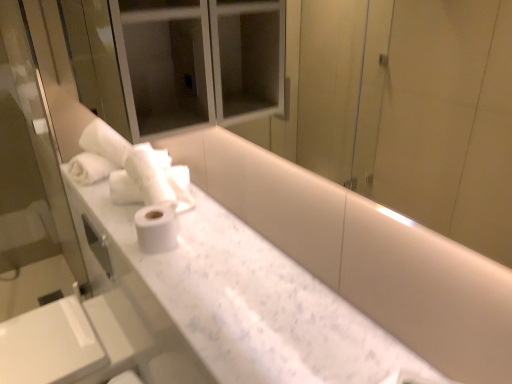
Identify the location of free point above white marble counter at center (from a real-world perspective). This screenshot has width=512, height=384. (202, 260).